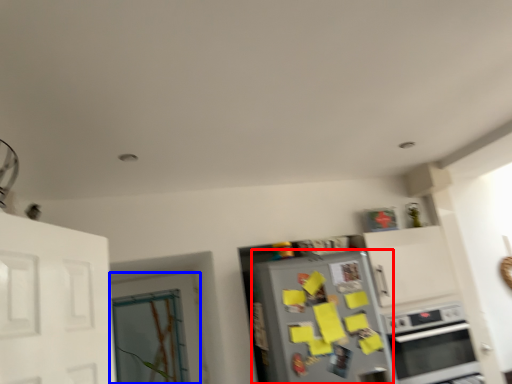
Question: Which object is further to the camera taking this photo, refrigerator (highlighted by a red box) or door (highlighted by a blue box)?

Choices:
 (A) refrigerator
 (B) door

Answer: (B)